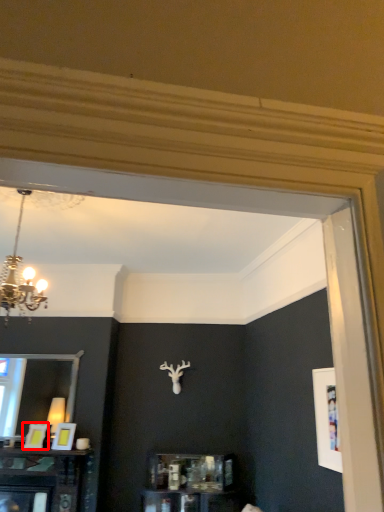
Question: In this image, where is picture frame (annotated by the red box) located relative to picture frame?

Choices:
 (A) right
 (B) left

Answer: (B)